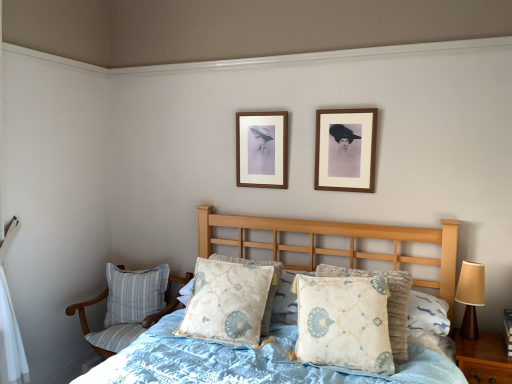
Question: Is floral-patterned fabric pillow at center, the 2th pillow viewed from the back, outside wooden picture frame at upper center, the 1th picture frame from the right?

Choices:
 (A) no
 (B) yes

Answer: (B)

Question: Considering the relative sizes of floral-patterned fabric pillow at center, the 2th pillow positioned from the left, and wooden picture frame at upper center, acting as the second picture frame starting from the left, in the image provided, is floral-patterned fabric pillow at center, the 2th pillow positioned from the left, taller than wooden picture frame at upper center, acting as the second picture frame starting from the left,?

Choices:
 (A) no
 (B) yes

Answer: (A)

Question: Does floral-patterned fabric pillow at center, the 2th pillow from the front, have a lesser width compared to wooden picture frame at upper center, the 1th picture frame from the right?

Choices:
 (A) yes
 (B) no

Answer: (B)

Question: From a real-world perspective, is floral-patterned fabric pillow at center, the 2th pillow positioned from the left, physically above wooden picture frame at upper center, which is the first picture frame from front to back?

Choices:
 (A) yes
 (B) no

Answer: (B)

Question: Is wooden picture frame at upper center, which ranks as the second picture frame in back-to-front order, at the back of floral-patterned fabric pillow at center, the 2th pillow viewed from the back?

Choices:
 (A) no
 (B) yes

Answer: (A)

Question: From a real-world perspective, is floral-patterned fabric pillow at center, the 1th pillow from the front, positioned above or below blue striped fabric pillow at lower left, marked as the third pillow in a front-to-back arrangement?

Choices:
 (A) below
 (B) above

Answer: (B)

Question: Considering the positions of floral-patterned fabric pillow at center, which is the third pillow in left-to-right order, and blue striped fabric pillow at lower left, marked as the 3th pillow in a right-to-left arrangement, in the image, is floral-patterned fabric pillow at center, which is the third pillow in left-to-right order, taller or shorter than blue striped fabric pillow at lower left, marked as the 3th pillow in a right-to-left arrangement,?

Choices:
 (A) short
 (B) tall

Answer: (B)

Question: Is point (384, 350) positioned closer to the camera than point (130, 281)?

Choices:
 (A) closer
 (B) farther

Answer: (A)

Question: From the image's perspective, is floral-patterned fabric pillow at center, which is counted as the third pillow, starting from the back, positioned above or below blue striped fabric pillow at lower left, marked as the 3th pillow in a right-to-left arrangement?

Choices:
 (A) below
 (B) above

Answer: (B)

Question: Is striped fabric chair at lower left taller or shorter than wooden picture frame at upper center, the 1th picture frame viewed from the left?

Choices:
 (A) short
 (B) tall

Answer: (B)

Question: Considering the relative positions of striped fabric chair at lower left and wooden picture frame at upper center, the second picture frame when ordered from front to back, in the image provided, is striped fabric chair at lower left to the left or to the right of wooden picture frame at upper center, the second picture frame when ordered from front to back,?

Choices:
 (A) right
 (B) left

Answer: (B)

Question: Is striped fabric chair at lower left wider or thinner than wooden picture frame at upper center, the second picture frame when ordered from front to back?

Choices:
 (A) wide
 (B) thin

Answer: (A)

Question: Considering the positions of striped fabric chair at lower left and wooden picture frame at upper center, placed as the first picture frame when sorted from back to front, in the image, is striped fabric chair at lower left bigger or smaller than wooden picture frame at upper center, placed as the first picture frame when sorted from back to front,?

Choices:
 (A) big
 (B) small

Answer: (A)

Question: In terms of height, does wooden picture frame at upper center, the 1th picture frame viewed from the left, look taller or shorter compared to floral-patterned fabric pillow at center, the 1th pillow from the front?

Choices:
 (A) short
 (B) tall

Answer: (A)

Question: From a real-world perspective, is wooden picture frame at upper center, the second picture frame when ordered from front to back, positioned above or below floral-patterned fabric pillow at center, which is the third pillow in left-to-right order?

Choices:
 (A) above
 (B) below

Answer: (A)